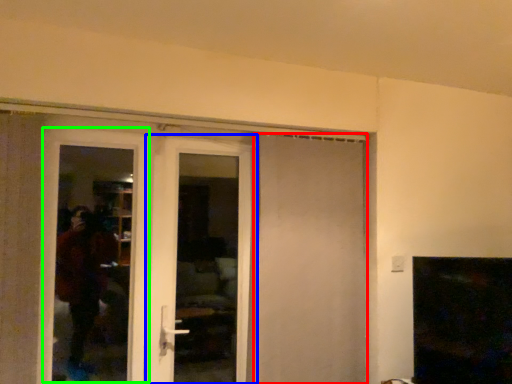
Question: Estimate the real-world distances between objects in this image. Which object is farther from door (highlighted by a red box), door (highlighted by a blue box) or screen door (highlighted by a green box)?

Choices:
 (A) door
 (B) screen door

Answer: (B)